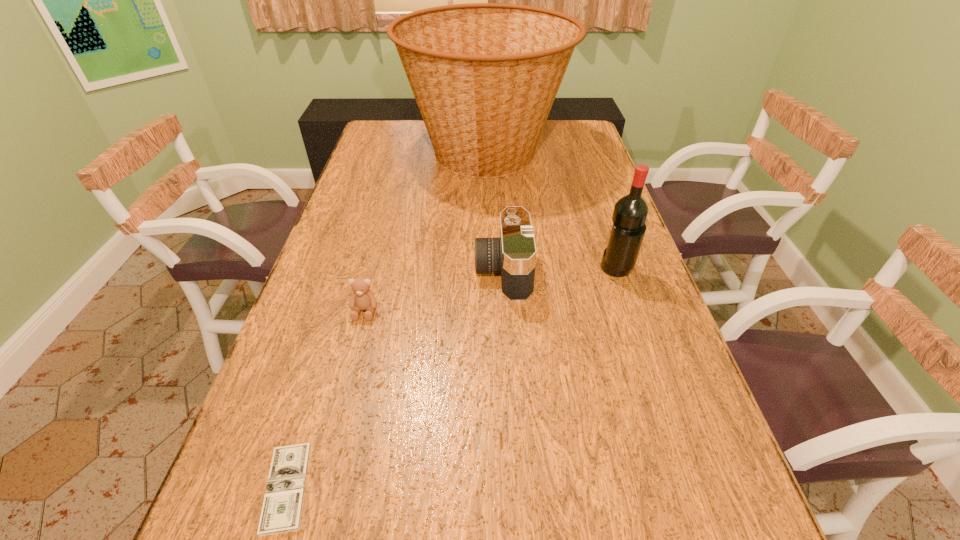
Identify the location of the farthest object. This screenshot has width=960, height=540. (484, 75).

Locate an element on the screen. This screenshot has width=960, height=540. the tallest object is located at coordinates (484, 75).

Where is `the second tallest object`? This screenshot has height=540, width=960. the second tallest object is located at coordinates click(630, 212).

Locate an element on the screen. camera is located at coordinates (513, 254).

Image resolution: width=960 pixels, height=540 pixels. What are the coordinates of `the fourth tallest object` in the screenshot? It's located at (362, 298).

Where is `the shortest object`? Image resolution: width=960 pixels, height=540 pixels. the shortest object is located at coordinates (281, 512).

You are a GUI agent. You are given a task and a screenshot of the screen. Output one action in this format:
    pyautogui.click(x=<x>, y=<y>)
    Task: Click on the nearest object
    The width and height of the screenshot is (960, 540).
    Given the screenshot: What is the action you would take?
    pyautogui.click(x=281, y=512)

Identify the location of free space located 0.070m on the left of the tallest object. The image size is (960, 540). (385, 154).

I want to click on vacant region located 0.380m on the left of the fourth shortest object, so click(x=456, y=271).

The width and height of the screenshot is (960, 540). What are the coordinates of `vacant region located 0.380m on the front-facing side of the camera` in the screenshot? It's located at (329, 271).